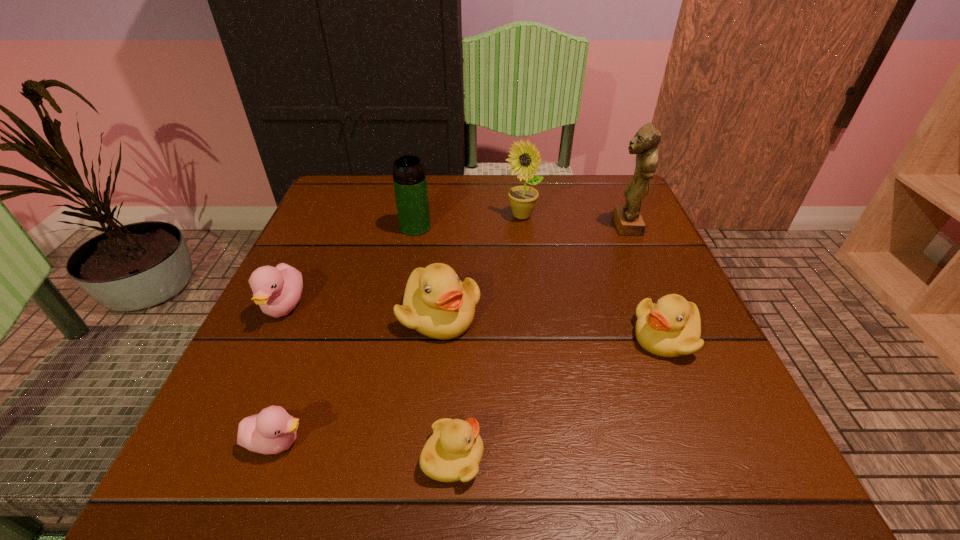
I want to click on vacant space positioned on the front-facing side of the figurine, so click(x=576, y=226).

You are a GUI agent. You are given a task and a screenshot of the screen. Output one action in this format:
    pyautogui.click(x=<x>, y=<y>)
    Task: Click on the free location located 0.380m on the front-facing side of the figurine
    
    Given the screenshot: What is the action you would take?
    pyautogui.click(x=446, y=226)

Where is `vacant point located on the front-facing side of the figurine`? The image size is (960, 540). vacant point located on the front-facing side of the figurine is located at coordinates (451, 226).

Locate an element on the screen. free space located from the spout of the green thermos bottle is located at coordinates (410, 255).

Identify the location of free space located 0.200m on the face of the sunflower. This screenshot has height=540, width=960. (530, 282).

The height and width of the screenshot is (540, 960). I want to click on free space located on the front-facing side of the biggest yellow duckling, so click(x=422, y=492).

Locate an element on the screen. The width and height of the screenshot is (960, 540). vacant position located on the front-facing side of the farther pink duckling is located at coordinates (221, 442).

At what (x,y) coordinates should I click in order to perform the action: click on blank space located on the front-facing side of the second smallest yellow duckling. Please return your answer as a coordinate pair (x, y). This screenshot has width=960, height=540. Looking at the image, I should click on (455, 336).

Where is `vacant space located 0.330m on the front-facing side of the second smallest yellow duckling`? The height and width of the screenshot is (540, 960). vacant space located 0.330m on the front-facing side of the second smallest yellow duckling is located at coordinates (444, 336).

What are the coordinates of `vacant area situated 0.380m on the front-facing side of the second smallest yellow duckling` in the screenshot? It's located at (415, 336).